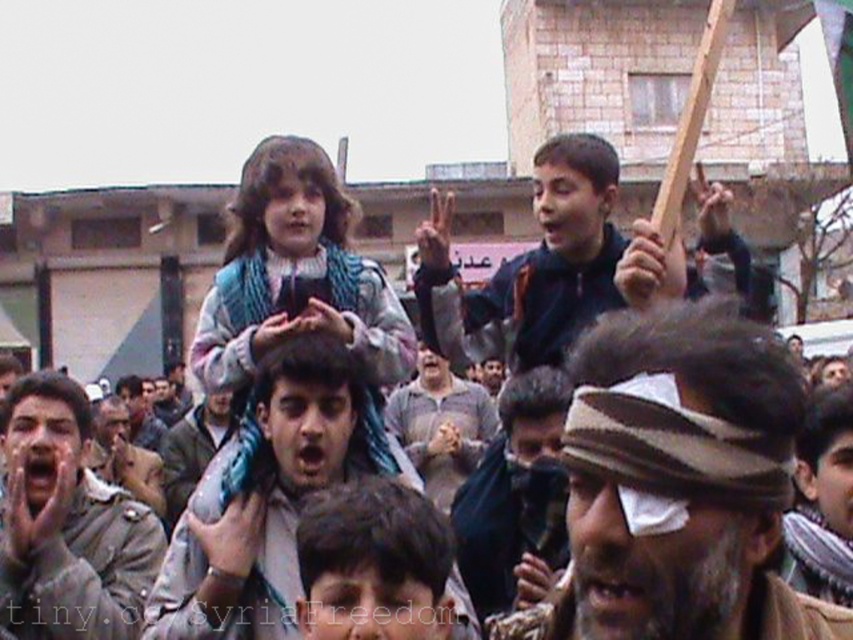
Question: Among these points, which one is nearest to the camera?

Choices:
 (A) (204, 637)
 (B) (572, 490)
 (C) (257, 340)
 (D) (410, 557)

Answer: (B)

Question: Can you confirm if gray uniformed man at left is smaller than dark brown hair at center?

Choices:
 (A) yes
 (B) no

Answer: (B)

Question: From the image, what is the correct spatial relationship of gray uniformed man at left in relation to brown leather hat at center?

Choices:
 (A) right
 (B) left

Answer: (B)

Question: Which is farther from the dark brown hair at center?

Choices:
 (A) brown leather hat at center
 (B) gray fabric scarf at center
 (C) dark brown leather jacket at center
 (D) gray cotton shirt at center

Answer: (B)

Question: Can you confirm if striped fabric headband at center is bigger than gray uniformed man at left?

Choices:
 (A) yes
 (B) no

Answer: (A)

Question: Which object appears farthest from the camera in this image?

Choices:
 (A) dark brown leather jacket at center
 (B) gray fabric scarf at center
 (C) blue knitted scarf at center
 (D) gray uniformed man at left

Answer: (B)